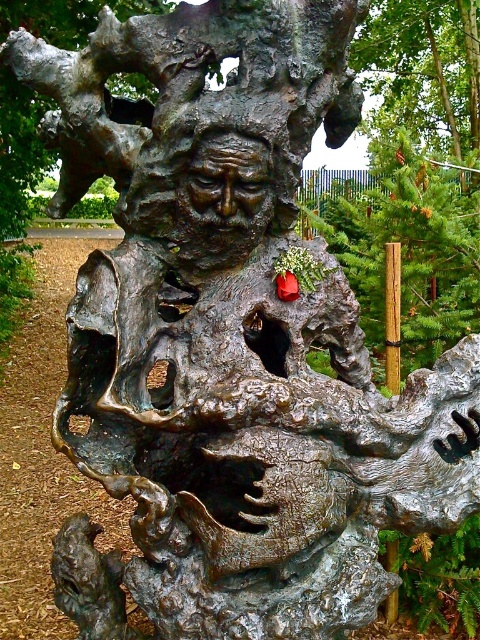
Question: Does green textured pine tree at upper center have a larger size compared to bronze textured face at center?

Choices:
 (A) yes
 (B) no

Answer: (A)

Question: Which point is closer to the camera?

Choices:
 (A) green textured pine tree at upper center
 (B) bronze textured face at center

Answer: (B)

Question: Does green textured pine tree at upper center appear over bronze textured face at center?

Choices:
 (A) no
 (B) yes

Answer: (B)

Question: Which object is closer to the camera taking this photo?

Choices:
 (A) bronze textured face at center
 (B) green textured pine tree at upper center

Answer: (A)

Question: Does green textured pine tree at upper center appear over bronze textured face at center?

Choices:
 (A) yes
 (B) no

Answer: (A)